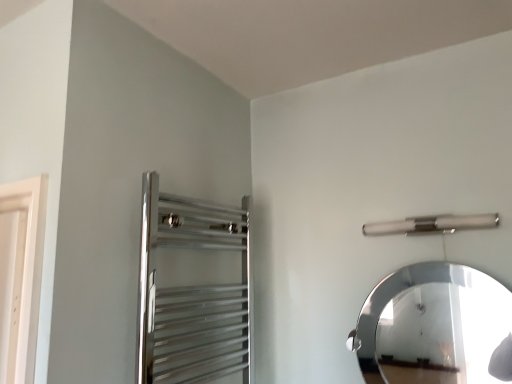
Question: Does polished chrome towel rack at upper left appear on the right side of polished silver mirror at upper right?

Choices:
 (A) no
 (B) yes

Answer: (A)

Question: Can you confirm if polished chrome towel rack at upper left is shorter than polished silver mirror at upper right?

Choices:
 (A) no
 (B) yes

Answer: (A)

Question: Is polished chrome towel rack at upper left turned away from polished silver mirror at upper right?

Choices:
 (A) yes
 (B) no

Answer: (B)

Question: Does polished chrome towel rack at upper left appear on the left side of polished silver mirror at upper right?

Choices:
 (A) no
 (B) yes

Answer: (B)

Question: Is polished chrome towel rack at upper left far away from polished silver mirror at upper right?

Choices:
 (A) yes
 (B) no

Answer: (A)

Question: Is polished silver mirror at upper right completely or partially inside polished chrome towel rack at upper left?

Choices:
 (A) no
 (B) yes

Answer: (A)

Question: Is satin nickel towel bar at upper right surrounding polished silver mirror at upper right?

Choices:
 (A) yes
 (B) no

Answer: (B)

Question: Is satin nickel towel bar at upper right aimed at polished silver mirror at upper right?

Choices:
 (A) no
 (B) yes

Answer: (A)

Question: Is satin nickel towel bar at upper right at the left side of polished silver mirror at upper right?

Choices:
 (A) yes
 (B) no

Answer: (B)

Question: Is satin nickel towel bar at upper right bigger than polished silver mirror at upper right?

Choices:
 (A) no
 (B) yes

Answer: (A)

Question: Is satin nickel towel bar at upper right outside of polished silver mirror at upper right?

Choices:
 (A) yes
 (B) no

Answer: (A)

Question: Is the depth of satin nickel towel bar at upper right greater than that of polished silver mirror at upper right?

Choices:
 (A) yes
 (B) no

Answer: (A)

Question: Does polished chrome towel rack at upper left have a greater height compared to satin nickel towel bar at upper right?

Choices:
 (A) yes
 (B) no

Answer: (A)